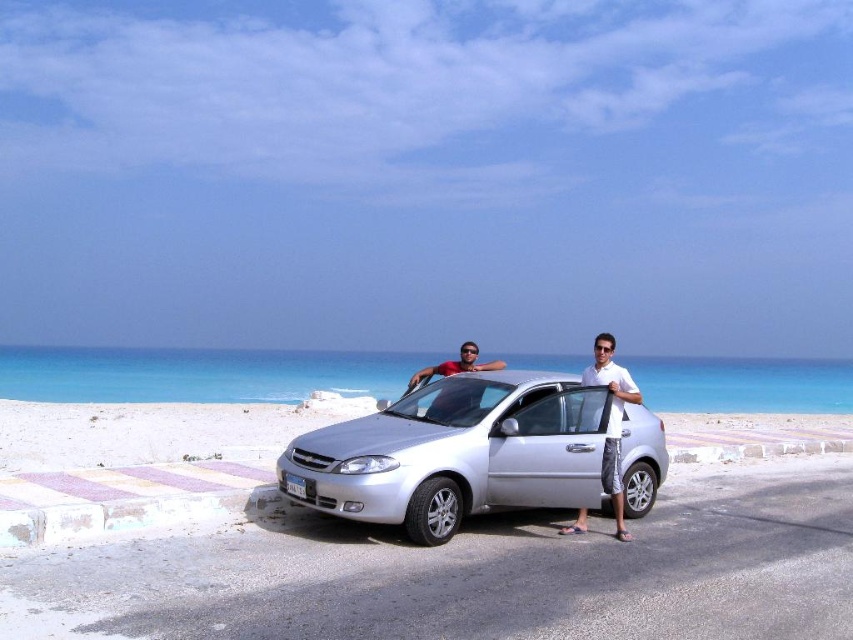
You are a photographer trying to capture both the silver metallic car at center and the matte black car at center in a single shot. Based on their positions, which car is blocking the view of the other?

The silver metallic car at center is positioned under the matte black car at center, so the matte black car at center is blocking the view of the silver metallic car at center.

You are a photographer trying to capture a photo of the white cotton shirt at center and the matte black car at center. Which object should you zoom in on to ensure both are in focus without moving the camera?

The white cotton shirt at center is smaller than the matte black car at center, so you should zoom in on the matte black car at center to ensure both are in focus without moving the camera.

You are a photographer trying to capture a wide shot of the scene. The white cotton shirt at center and the matte black car at center are both in your frame. Since you want to ensure both are fully visible, which object should you focus on first to account for their sizes?

The white cotton shirt at center is thinner than the matte black car at center, so you should focus on the matte black car at center first as it is larger and requires more attention to detail to ensure it is fully captured in the frame.